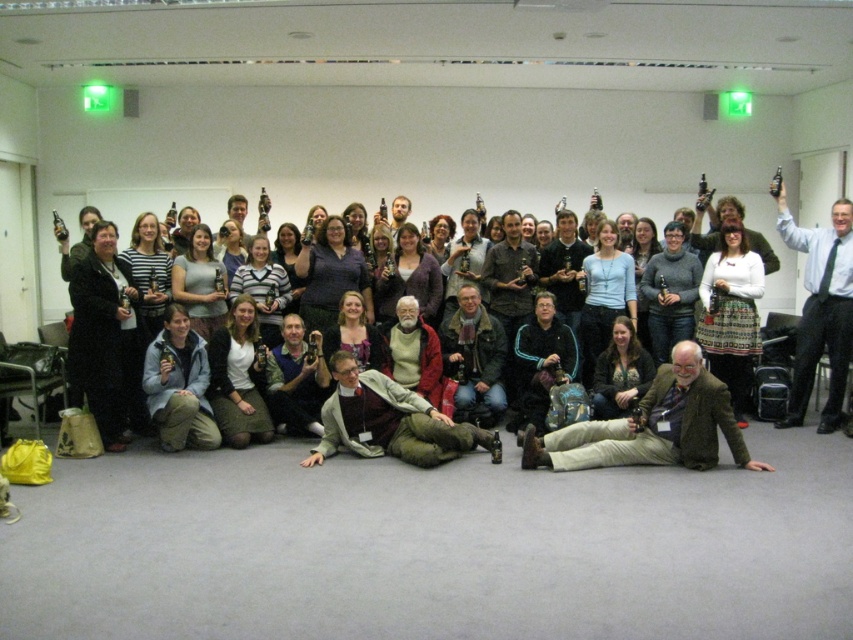
You are organizing a photo shoot and need to ensure that all participants are visible. You notice the light gray sweater at center and the white shirt at upper right. Which of these two items has a greater width in the image?

The light gray sweater at center has a greater width than the white shirt at upper right.

Looking at the group photo, where is the light gray sweater at center in relation to the white shirt at upper right?

The light gray sweater at center is to the left of the white shirt at upper right.

You are a photographer adjusting the camera focus. You need to ensure both the light gray sweater at center and the white shirt at upper right are in focus. Which object should you focus on first to account for their sizes?

The light gray sweater at center is shorter than the white shirt at upper right, so you should focus on the white shirt at upper right first since it is larger and requires more precise focus to ensure clarity.